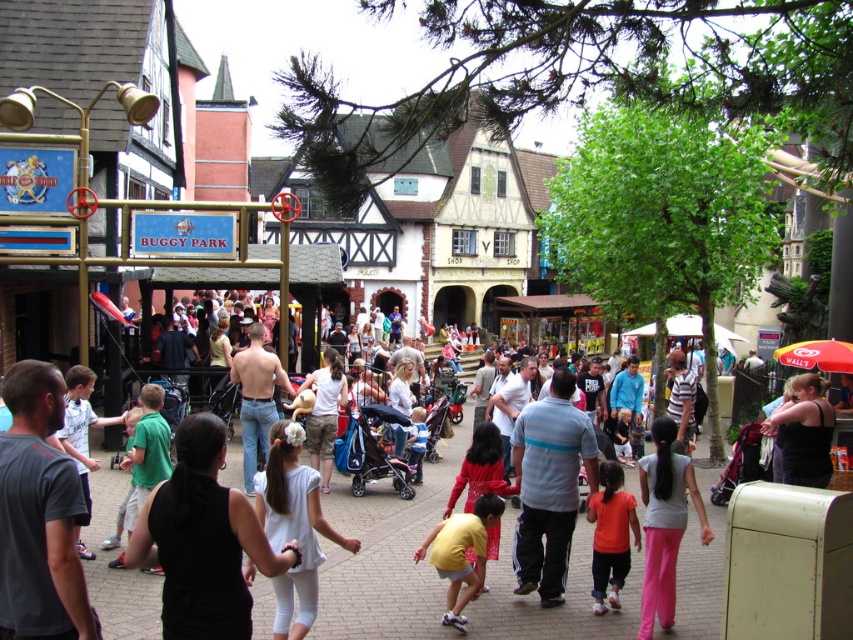
You are a photographer at the BUGGY PARK. You need to take a group photo of the yellow matte shirt at center and the orange cotton shirt at center. Which shirt should you move closer to the camera to make them appear the same size in the photo?

To make the yellow matte shirt at center and the orange cotton shirt at center appear the same size in the photo, move the smaller yellow matte shirt at center closer to the camera since it is smaller than the orange cotton shirt at center.

You are standing at the entrance of the BUGGY PARK and want to find the person wearing the yellow matte shirt at center. According to the coordinates provided, in which direction should you look to locate this person?

The yellow matte shirt at center is located at point coordinates approximately 0.867 on the x axis and 0.542 on the y axis. Since the coordinate system typically starts at the bottom left corner, a higher x value means further to the right and a higher y value means higher up. Therefore, to locate the yellow matte shirt at center, you should look towards the upper right direction from your current position at the entrance.

From the picture: You are standing at the center of the BUGGY PARK area. You notice a yellow matte shirt at center. Can you confirm if the yellow matte shirt at center is located exactly at the point with coordinates (x=461, y=554)?

Yes, the yellow matte shirt at center is located exactly at the point with coordinates (x=461, y=554) as stated in the description.